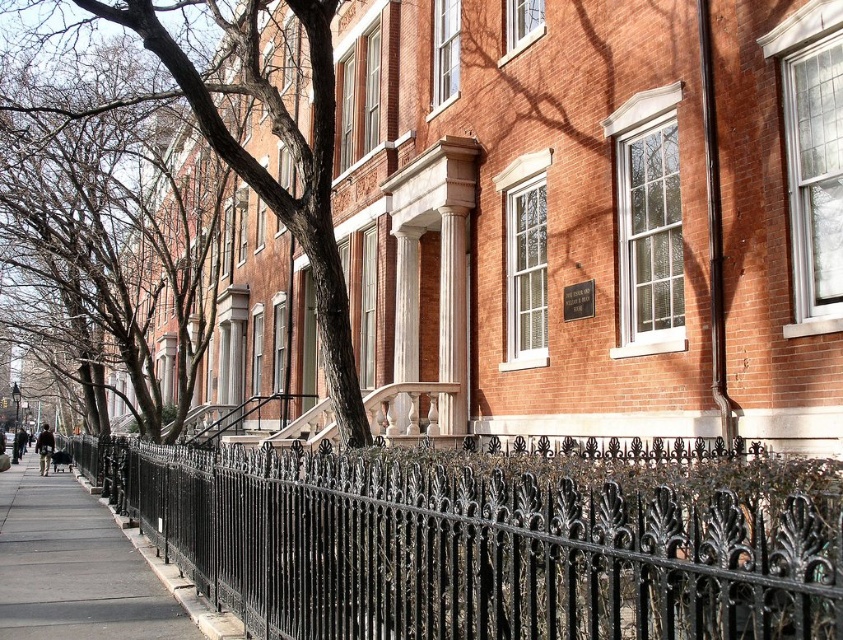
Can you confirm if brown bark tree at center is taller than gray concrete sidewalk at lower left?

Yes.

What do you see at coordinates (254, 157) in the screenshot?
I see `brown bark tree at center` at bounding box center [254, 157].

Does point (282, 132) come in front of point (25, 592)?

Yes, point (282, 132) is in front of point (25, 592).

You are a GUI agent. You are given a task and a screenshot of the screen. Output one action in this format:
    pyautogui.click(x=<x>, y=<y>)
    Task: Click on the brown bark tree at center
    The height and width of the screenshot is (640, 843).
    Given the screenshot: What is the action you would take?
    pyautogui.click(x=254, y=157)

Who is taller, black wrought iron fence at lower center or brown bark tree at center?

brown bark tree at center is taller.

Can you confirm if black wrought iron fence at lower center is positioned above brown bark tree at center?

No, black wrought iron fence at lower center is not above brown bark tree at center.

Does point (651, 531) come farther from viewer compared to point (240, 36)?

No.

This screenshot has height=640, width=843. Identify the location of black wrought iron fence at lower center. (470, 548).

Does black wrought iron fence at lower center appear on the right side of gray concrete sidewalk at lower left?

Indeed, black wrought iron fence at lower center is positioned on the right side of gray concrete sidewalk at lower left.

Is black wrought iron fence at lower center thinner than gray concrete sidewalk at lower left?

Indeed, black wrought iron fence at lower center has a lesser width compared to gray concrete sidewalk at lower left.

Find the location of a particular element. The image size is (843, 640). black wrought iron fence at lower center is located at coordinates (470, 548).